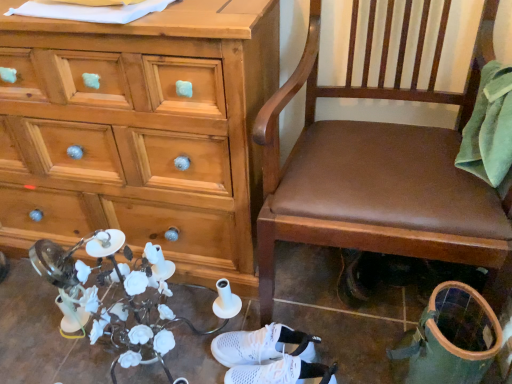
Question: Considering the positions of white mesh sneakers at lower center, marked as the 1th footwear in a front-to-back arrangement, and white mesh sneakers at center, the second footwear positioned from the front, in the image, is white mesh sneakers at lower center, marked as the 1th footwear in a front-to-back arrangement, bigger or smaller than white mesh sneakers at center, the second footwear positioned from the front,?

Choices:
 (A) big
 (B) small

Answer: (B)

Question: From the image's perspective, relative to white mesh sneakers at center, arranged as the first footwear when viewed from the back, is white mesh sneakers at lower center, marked as the 1th footwear in a front-to-back arrangement, above or below?

Choices:
 (A) above
 (B) below

Answer: (B)

Question: Based on their relative distances, which object is farther from the brown leather chair at center?

Choices:
 (A) wooden chest of drawers at left
 (B) white mesh sneakers at lower center, the 2th footwear in the back-to-front sequence
 (C) white mesh sneakers at center, the second footwear positioned from the front

Answer: (B)

Question: Based on their relative distances, which object is nearer to the white mesh sneakers at lower center, marked as the 1th footwear in a front-to-back arrangement?

Choices:
 (A) brown leather chair at center
 (B) white mesh sneakers at center, the second footwear positioned from the front
 (C) wooden chest of drawers at left

Answer: (B)